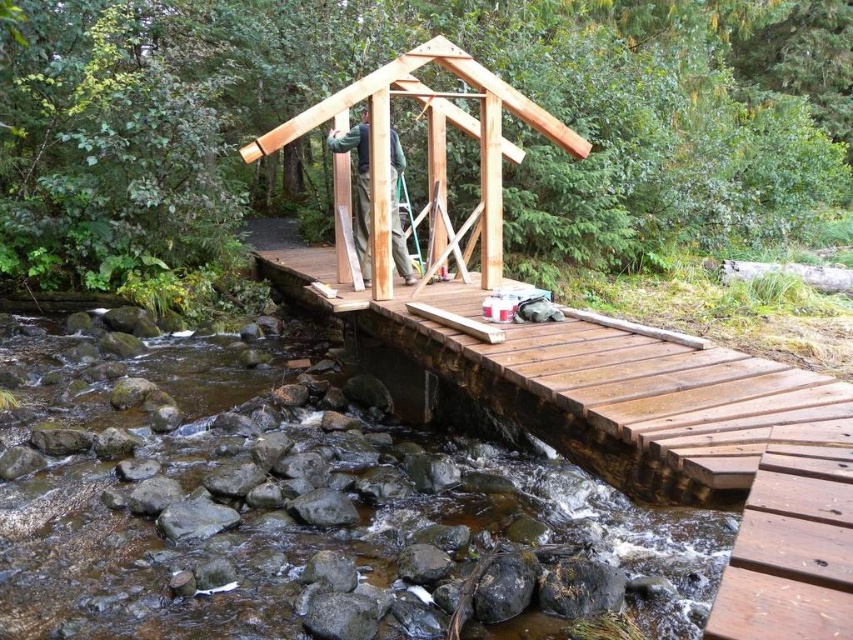
Between natural wood bridge at center and natural wood cabin at center, which one appears on the right side from the viewer's perspective?

Positioned to the right is natural wood bridge at center.

Who is more forward, (656, 428) or (373, 106)?

Point (656, 428) is in front.

Find the location of `natural wood bridge at center`. natural wood bridge at center is located at coordinates (548, 324).

Locate an element on the screen. This screenshot has width=853, height=640. brown smooth rocks at lower left is located at coordinates (288, 502).

In the scene shown: Can you confirm if brown smooth rocks at lower left is wider than natural wood cabin at center?

No.

Is point (119, 506) behind point (514, 102)?

No, it is not.

Identify the location of brown smooth rocks at lower left. (288, 502).

Does brown smooth rocks at lower left have a greater width compared to natural wood bridge at center?

Yes, brown smooth rocks at lower left is wider than natural wood bridge at center.

Can you confirm if brown smooth rocks at lower left is positioned above natural wood bridge at center?

Actually, brown smooth rocks at lower left is below natural wood bridge at center.

Which is behind, point (6, 564) or point (476, 362)?

The point (476, 362) is behind.

I want to click on brown smooth rocks at lower left, so click(x=288, y=502).